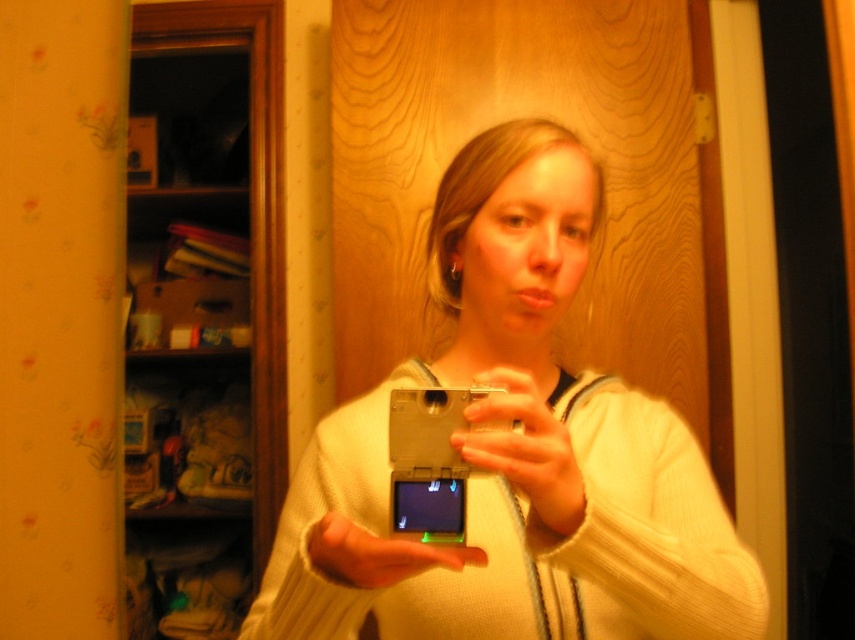
Question: Which point is closer to the camera taking this photo?

Choices:
 (A) (470, 301)
 (B) (417, 496)

Answer: (B)

Question: In this image, where is silver metallic camera at center located relative to metallic silver phone at center?

Choices:
 (A) above
 (B) below

Answer: (A)

Question: Does silver metallic camera at center have a lesser width compared to metallic silver phone at center?

Choices:
 (A) yes
 (B) no

Answer: (B)

Question: Does silver metallic camera at center appear under metallic silver phone at center?

Choices:
 (A) no
 (B) yes

Answer: (A)